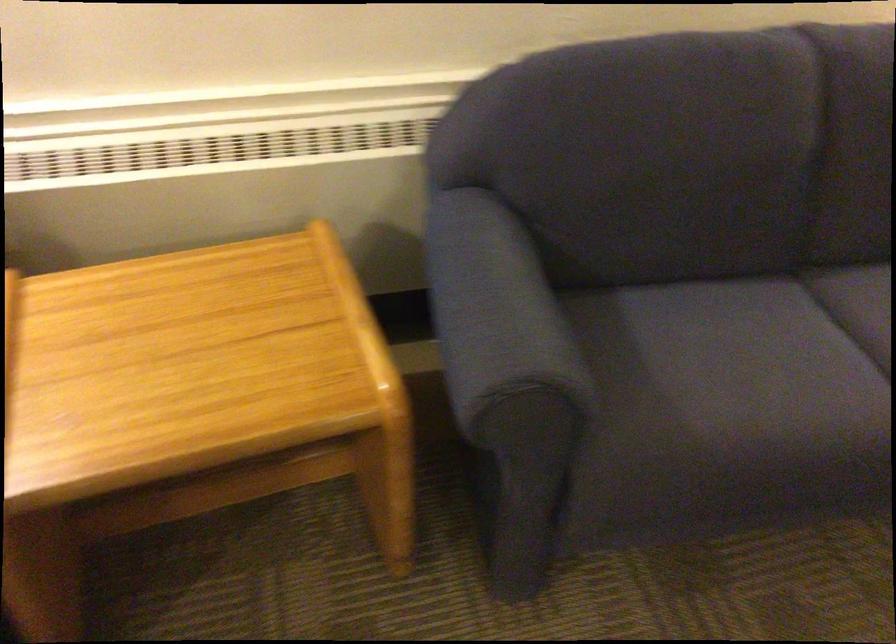
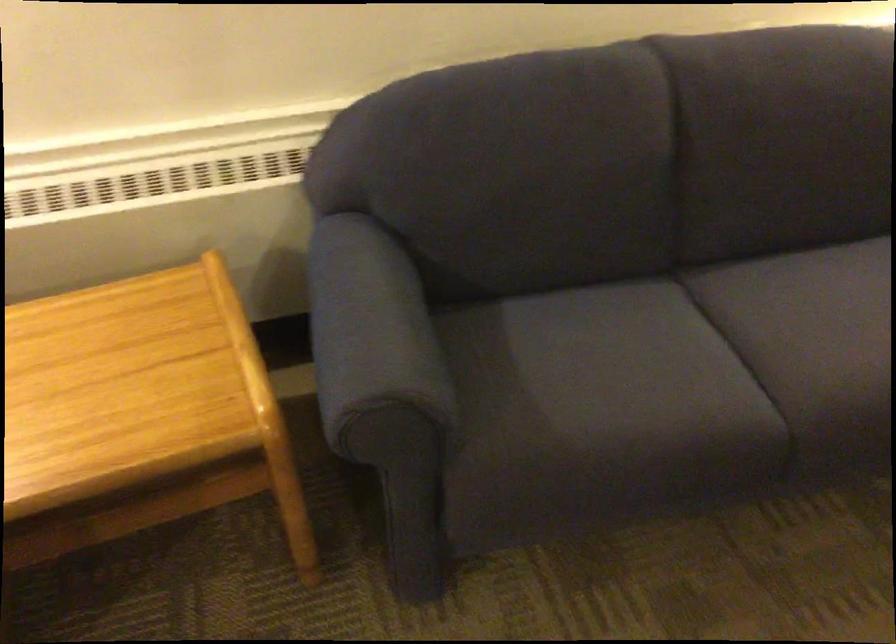
Question: Based on the continuous images, in which direction is the camera rotating? Reply with the corresponding letter.

Choices:
 (A) Left
 (B) Right
 (C) Up
 (D) Down

Answer: (B)